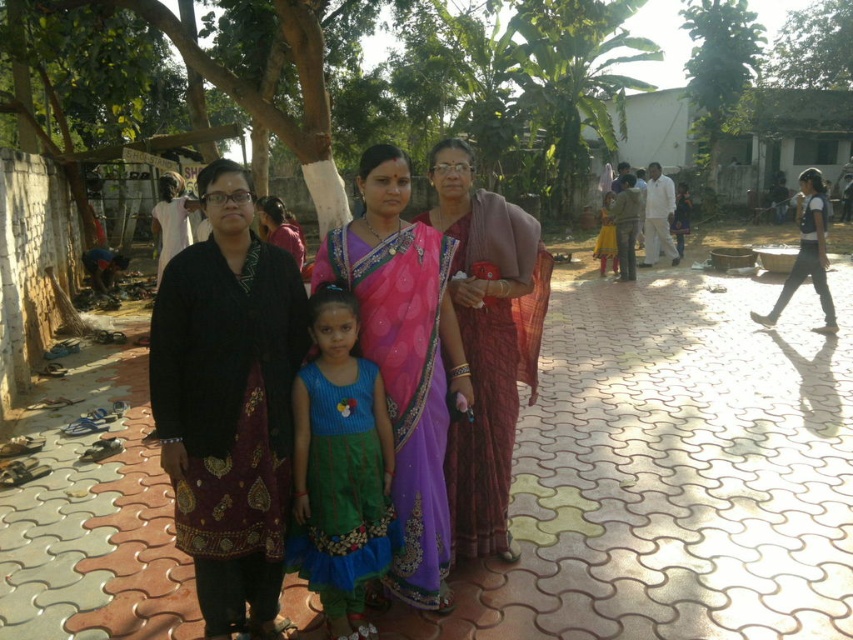
Question: Is matte pink sari at center below green leafy tree at upper center?

Choices:
 (A) yes
 (B) no

Answer: (A)

Question: Which of these objects is positioned farthest from the purple satin saree at center?

Choices:
 (A) black textured dress at center
 (B) brown woven sari at center
 (C) blue textured dress at center

Answer: (A)

Question: Can you confirm if purple satin saree at center is positioned above green leafy tree at upper right?

Choices:
 (A) no
 (B) yes

Answer: (A)

Question: Is matte pink sari at center bigger than yellow cotton dress at center?

Choices:
 (A) no
 (B) yes

Answer: (A)

Question: Which is farther from the matte pink sari at center?

Choices:
 (A) blue textured dress at center
 (B) purple satin saree at center

Answer: (A)

Question: Which of the following is the farthest from the observer?

Choices:
 (A) (589, 84)
 (B) (372, 166)
 (C) (653, 195)
 (D) (833, 88)

Answer: (D)